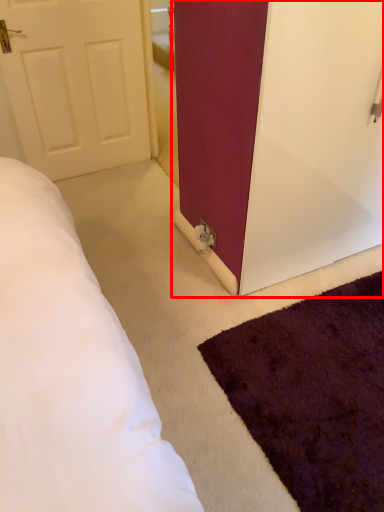
Question: From the image, what is the correct spatial relationship of door (annotated by the red box) in relation to mat?

Choices:
 (A) left
 (B) right

Answer: (A)